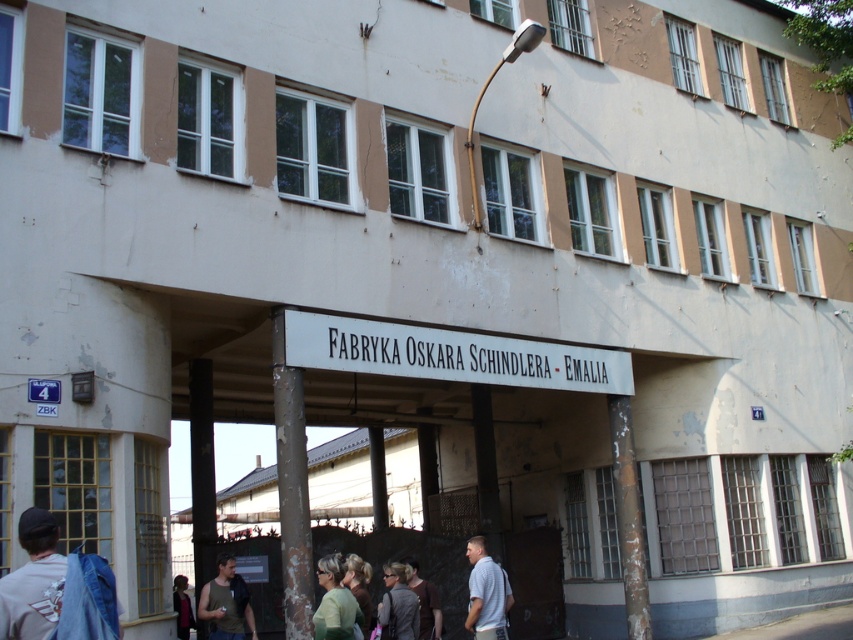
You are standing at the entrance of the building and notice the rusty metal pillar at center and the light green fabric shirt at lower center. Which object is closer to the ground?

The rusty metal pillar at center is closer to the ground because it is below the light green fabric shirt at lower center.

In the scene shown: You are standing at the entrance of the building and want to take a photo of both the point at coordinate [633,468] and the point at coordinate [326,560]. Which point should you focus on first to ensure both are in focus?

You should focus on the point at coordinate [633,468] first because it is closer to the camera than the point at coordinate [326,560]. This ensures that both points will be in focus when using a camera with a fixed focal length.